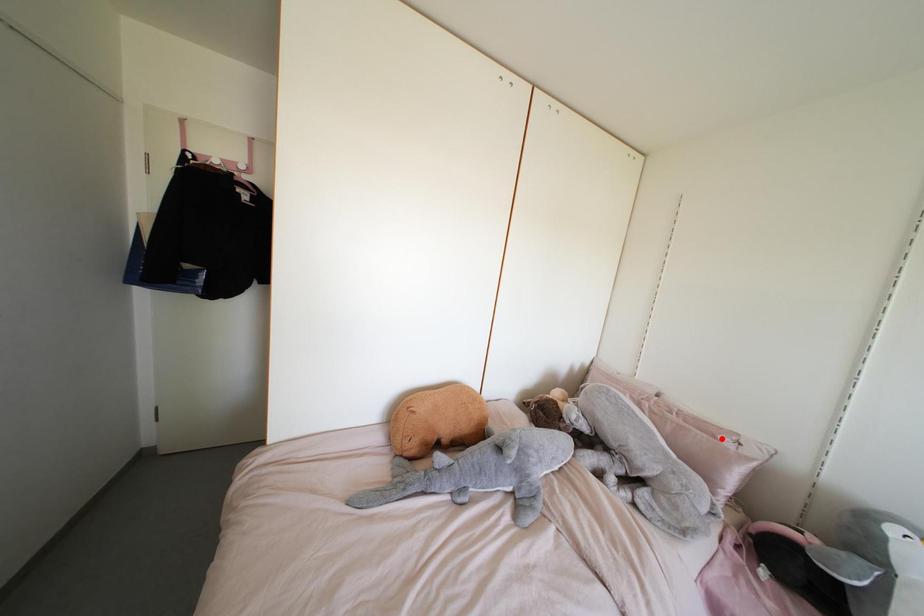
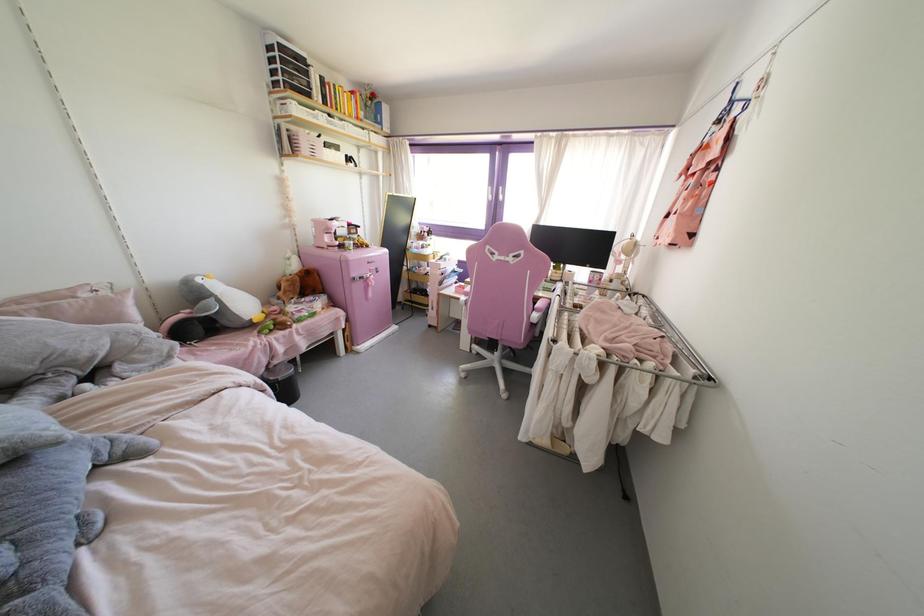
In the second image, find the point that corresponds to the highlighted location in the first image.

(83, 294)